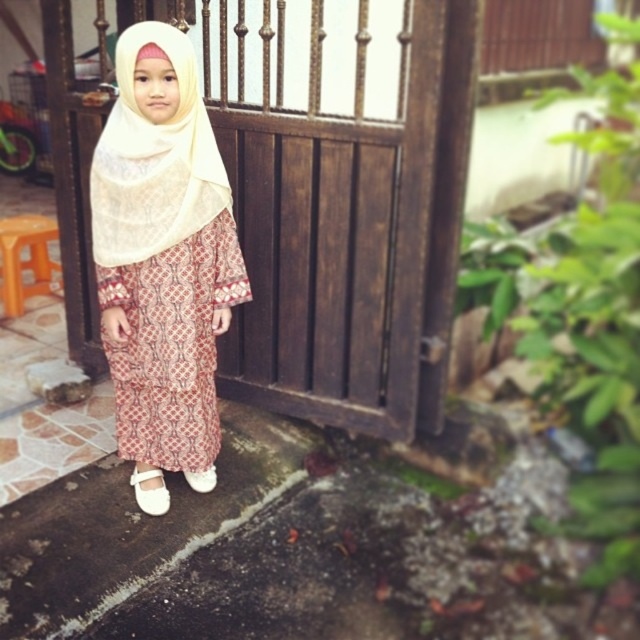
Does point (412, 65) come behind point (179, 131)?

That is True.

What do you see at coordinates (330, 198) in the screenshot? I see `wooden gate at center` at bounding box center [330, 198].

The image size is (640, 640). Identify the location of wooden gate at center. click(330, 198).

Does wooden gate at center have a greater width compared to white fabric shoe at lower center?

Yes.

Is point (224, 192) more distant than point (211, 486)?

No, it is in front of (211, 486).

Locate an element on the screen. wooden gate at center is located at coordinates (330, 198).

Is batik-patterned dress at center taller than white leather shoe at lower center?

Yes, batik-patterned dress at center is taller than white leather shoe at lower center.

Can you confirm if batik-patterned dress at center is thinner than white leather shoe at lower center?

No.

In order to click on batik-patterned dress at center in this screenshot , I will do `click(172, 346)`.

This screenshot has height=640, width=640. In order to click on batik-patterned dress at center in this screenshot , I will do `click(172, 346)`.